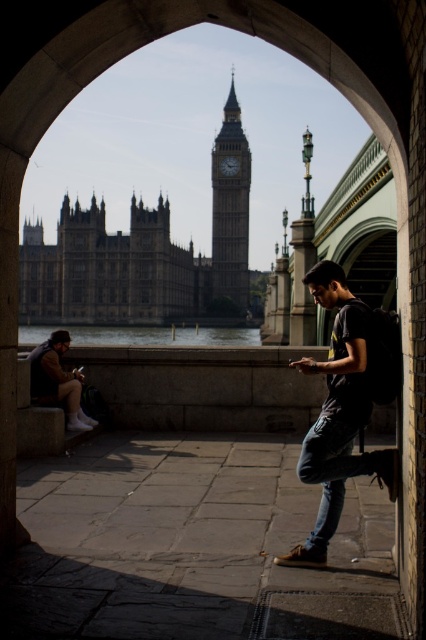
Question: Which object appears farthest from the camera in this image?

Choices:
 (A) dark brown leather jacket at lower left
 (B) brown stone building at center
 (C) polished stone clock tower at center

Answer: (C)

Question: Is dark blue jeans at center to the left of polished stone clock tower at center from the viewer's perspective?

Choices:
 (A) yes
 (B) no

Answer: (B)

Question: From the image, what is the correct spatial relationship of dark blue jeans at center in relation to dark brown leather jacket at lower left?

Choices:
 (A) left
 (B) right

Answer: (B)

Question: Which point is closer to the camera?

Choices:
 (A) (333, 499)
 (B) (55, 388)
 (C) (40, 241)

Answer: (A)

Question: Is brown stone building at center wider than dark blue jeans at center?

Choices:
 (A) yes
 (B) no

Answer: (A)

Question: Which is nearer to the polished stone clock tower at center?

Choices:
 (A) dark brown leather jacket at lower left
 (B) dark blue jeans at center
 (C) brown stone building at center

Answer: (C)